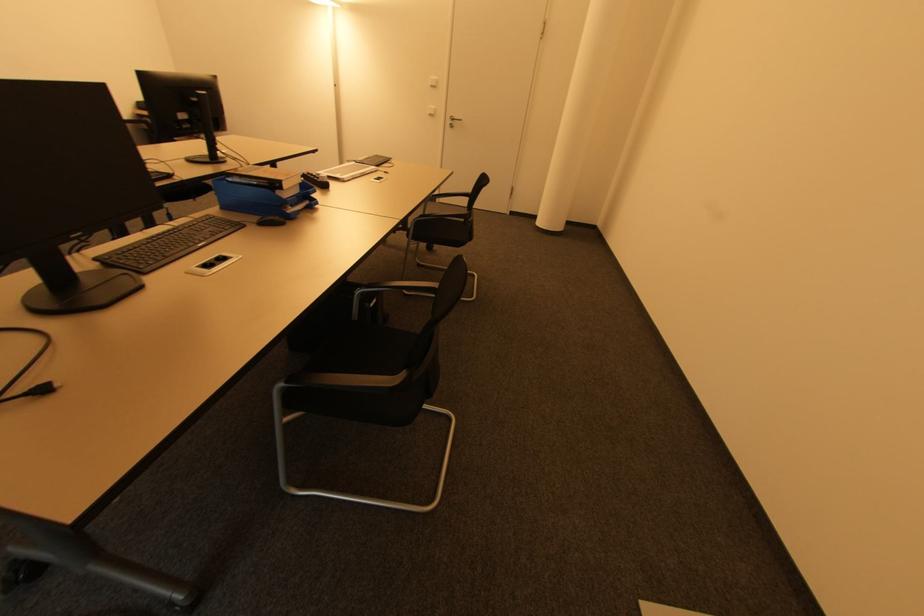
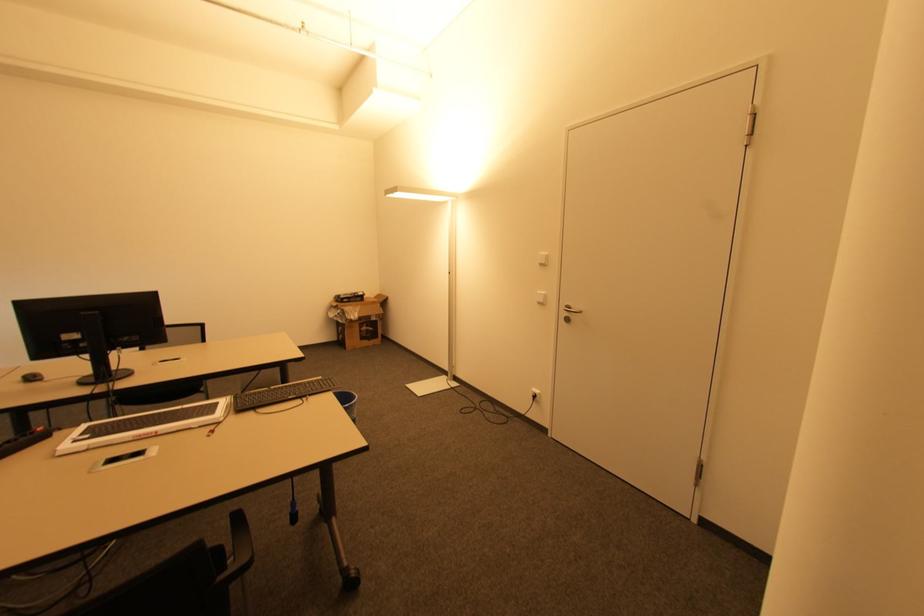
Locate, in the second image, the point that corresponds to the point at 454,127 in the first image.

(568, 320)